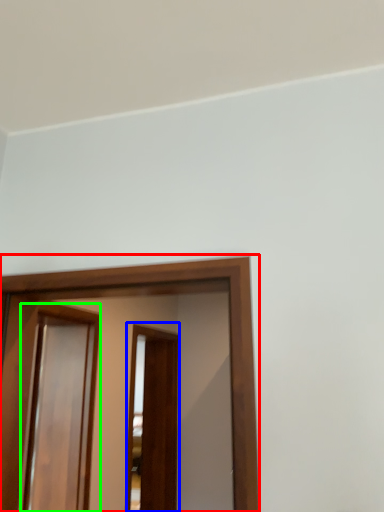
Question: Based on their relative distances, which object is farther from screen door (highlighted by a red box)? Choose from screen door (highlighted by a blue box) and screen door (highlighted by a green box).

Choices:
 (A) screen door
 (B) screen door

Answer: (A)